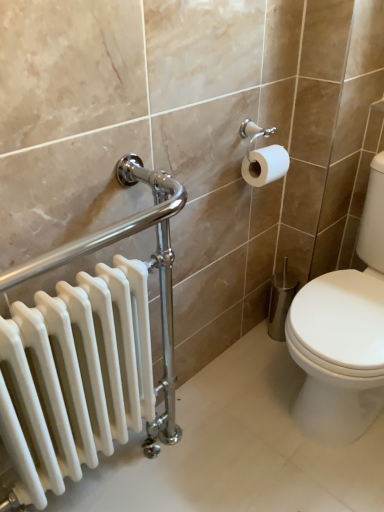
Identify the location of free space to the right of white glossy radiator at left. Image resolution: width=384 pixels, height=512 pixels. (241, 456).